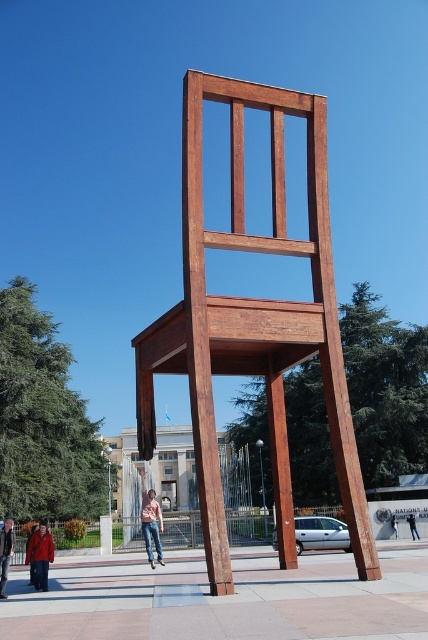
You are standing in the plaza and want to take a photo of the wooden chair sculpture. The camera you are using has a maximum focus range of 12 meters. Will the camera be able to focus on the chair sculpture located at point (38, 556)?

The distance between point (38, 556) and the viewer is 12.59 meters, which exceeds the camera maximum focus range of 12 meters. Therefore, the camera will not be able to focus on the chair sculpture located at point (38, 556).

You are a delivery person who needs to place a denim jacket at lower center onto the wooden chair at center. The jacket weighs 1.5 kilograms. Can you lift it manually to the chair without any equipment?

The wooden chair at center is 14.35 meters away from the denim jacket at lower center. Since the distance is too far to manually lift the jacket, you will need equipment to transport it.